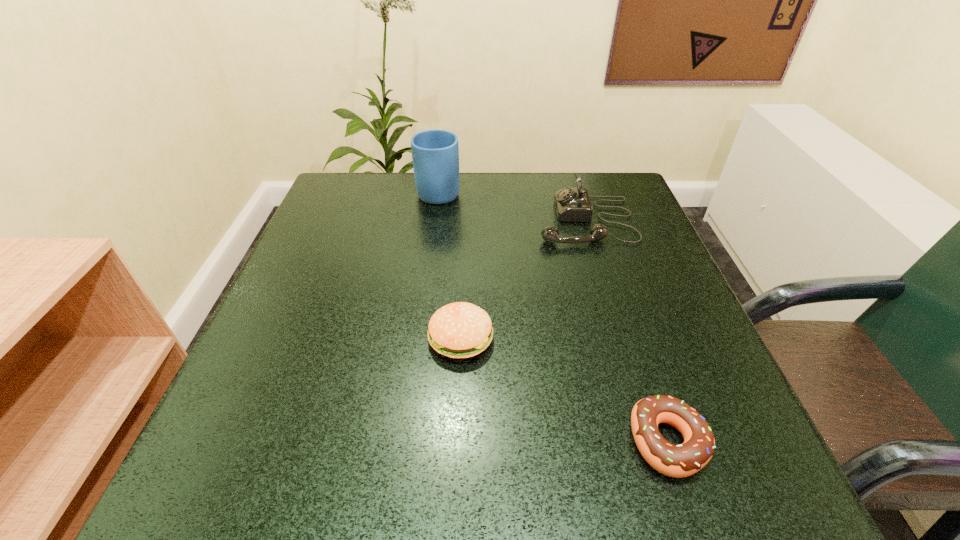
Image resolution: width=960 pixels, height=540 pixels. In the image, there is a desktop. Find the location of `vacant space at the right edge`. vacant space at the right edge is located at coordinates (679, 367).

Image resolution: width=960 pixels, height=540 pixels. I want to click on vacant region at the far left corner of the desktop, so click(331, 202).

Locate an element on the screen. free space at the far right corner of the desktop is located at coordinates (621, 182).

Identify the location of free point between the patty and the nearest object. (564, 390).

What are the coordinates of `vacant space that is in between the telephone and the tallest object` in the screenshot? It's located at (513, 205).

Identify the location of vacant space that's between the doughnut and the telephone. The image size is (960, 540). (627, 331).

The height and width of the screenshot is (540, 960). I want to click on free space between the doughnut and the second nearest object, so click(x=564, y=390).

Where is `unoccupied area between the nearest object and the telephone`? Image resolution: width=960 pixels, height=540 pixels. unoccupied area between the nearest object and the telephone is located at coordinates (627, 331).

At what (x,y) coordinates should I click in order to perform the action: click on free spot between the second tallest object and the third farthest object. Please return your answer as a coordinate pair (x, y). The height and width of the screenshot is (540, 960). Looking at the image, I should click on tap(523, 280).

Locate an element on the screen. free space that is in between the telephone and the mug is located at coordinates (513, 205).